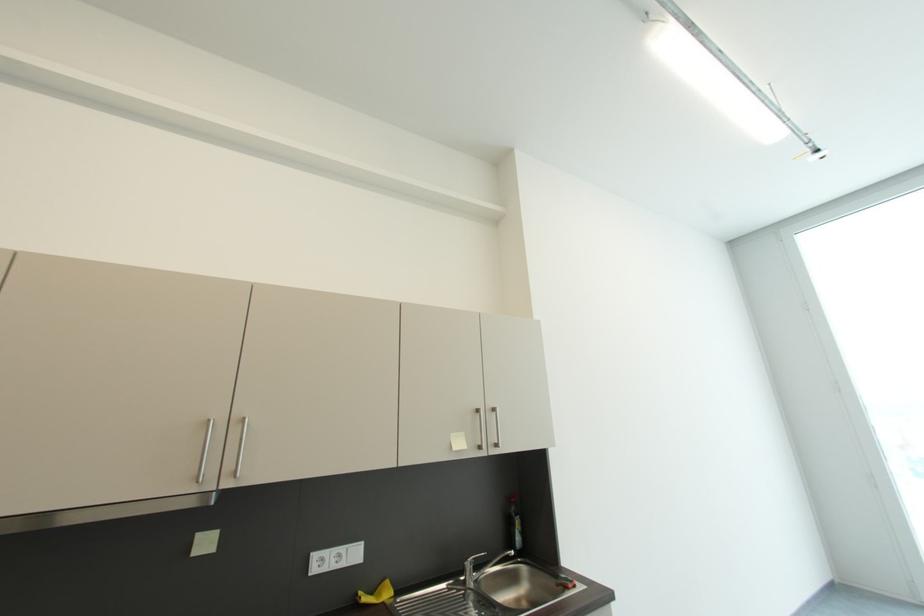
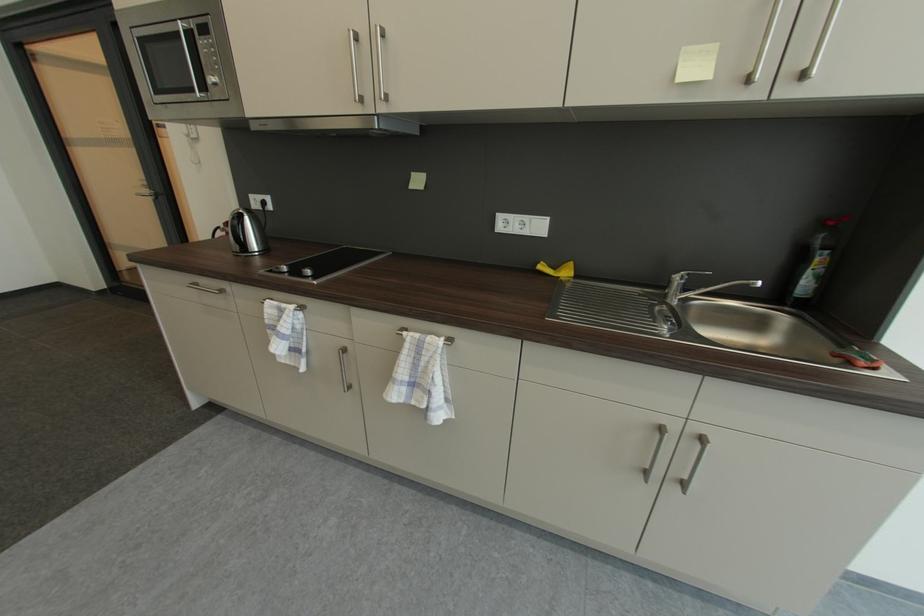
The images are taken continuously from a first-person perspective. In which direction is your viewpoint rotating?

The camera's rotation is toward left-down.